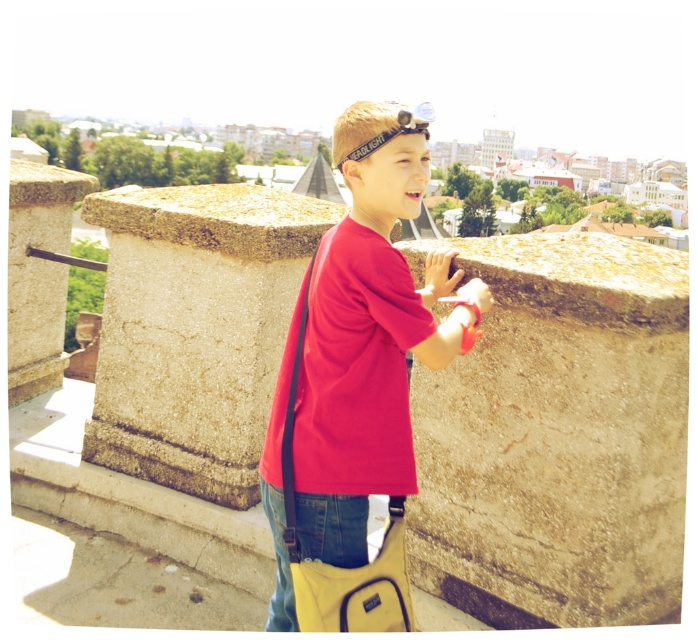
Question: Which point is farther from the camera taking this photo?

Choices:
 (A) (227, 195)
 (B) (339, 307)

Answer: (A)

Question: Which of the following is the closest to the observer?

Choices:
 (A) matte red t-shirt at center
 (B) granite-like stone pillar at center

Answer: (A)

Question: Is granite-like stone pillar at center wider than matte red t-shirt at center?

Choices:
 (A) yes
 (B) no

Answer: (A)

Question: Does granite-like stone pillar at center appear on the right side of matte red t-shirt at center?

Choices:
 (A) no
 (B) yes

Answer: (A)

Question: Does granite-like stone pillar at center have a lesser width compared to matte red t-shirt at center?

Choices:
 (A) yes
 (B) no

Answer: (B)